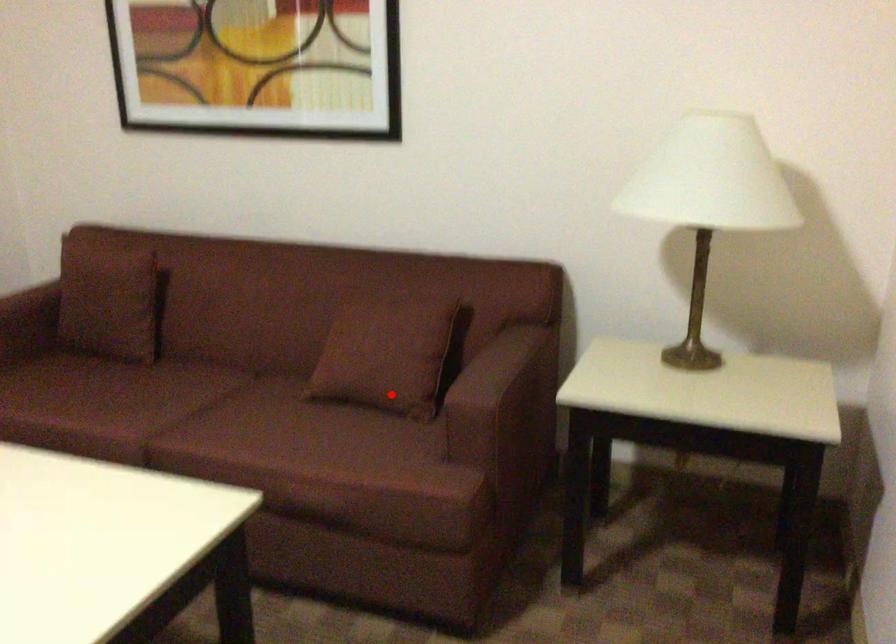
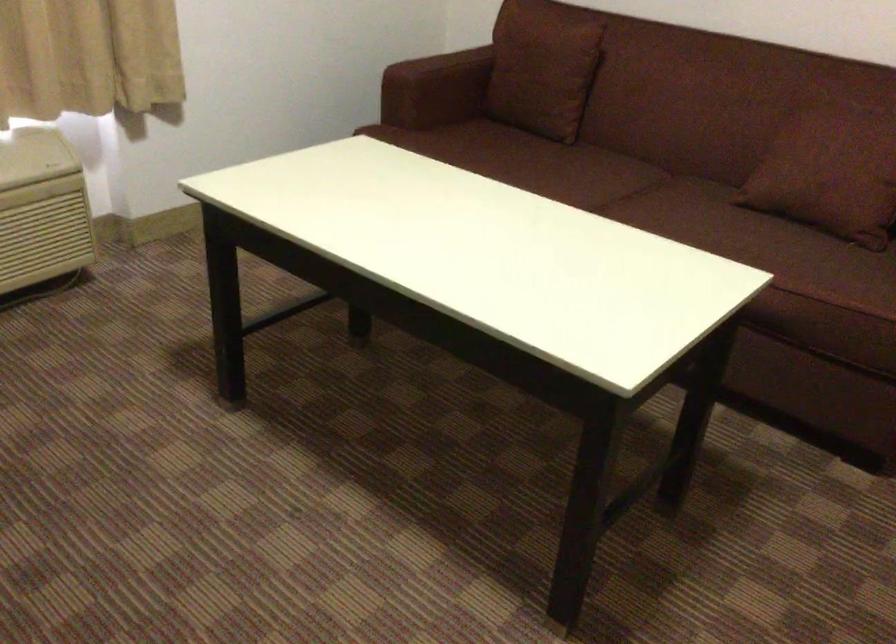
Question: I am providing you with two images of the same scene from different viewpoints. A red point is marked on the first image. Is the red point's position out of view in image 2?

Choices:
 (A) Yes
 (B) No

Answer: (B)